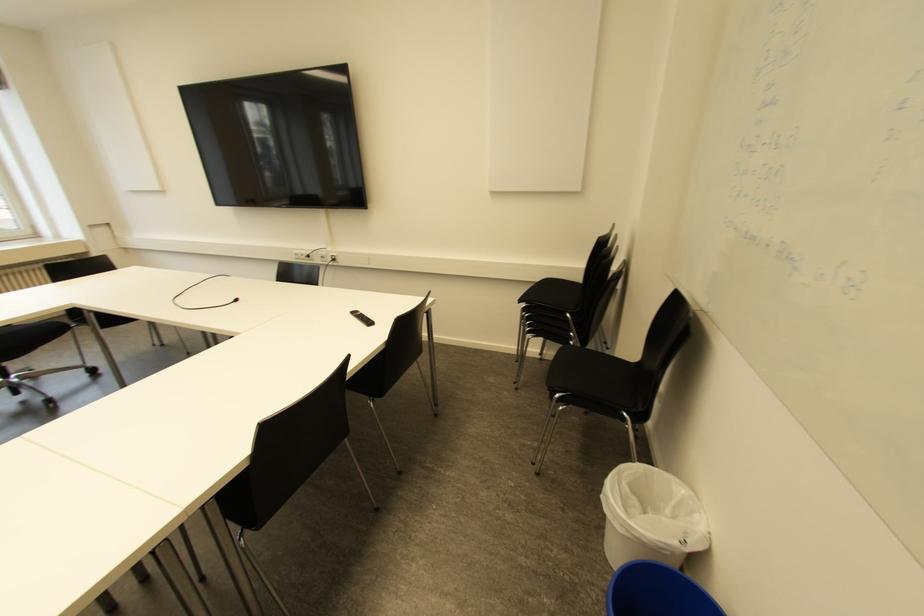
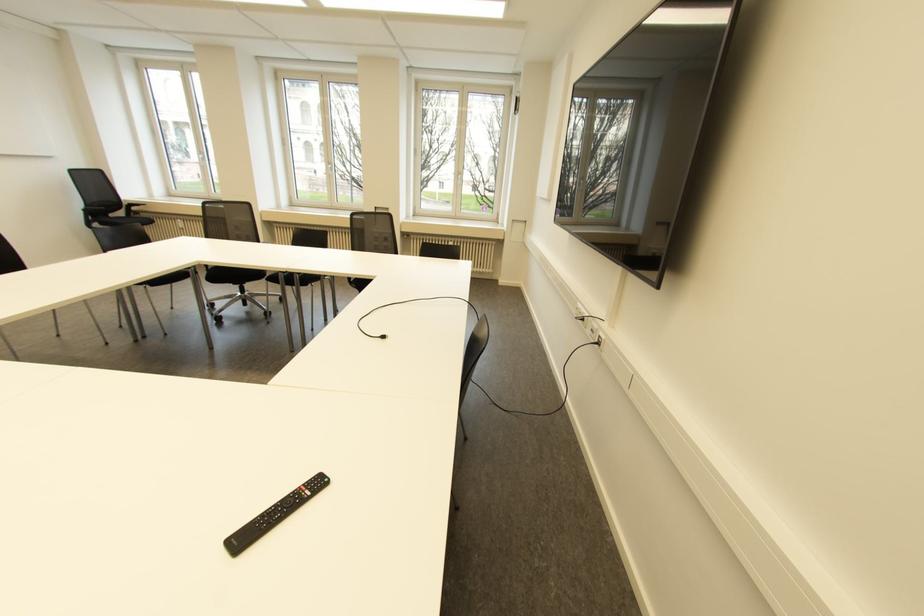
In the second image, find the point that corresponds to point 334,259 in the first image.

(598, 342)